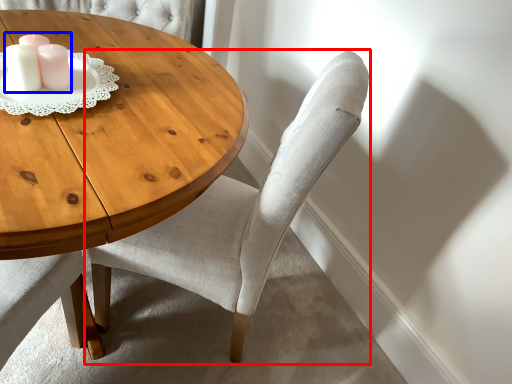
Question: Which object is closer to the camera taking this photo, chair (highlighted by a red box) or candle holder (highlighted by a blue box)?

Choices:
 (A) chair
 (B) candle holder

Answer: (A)